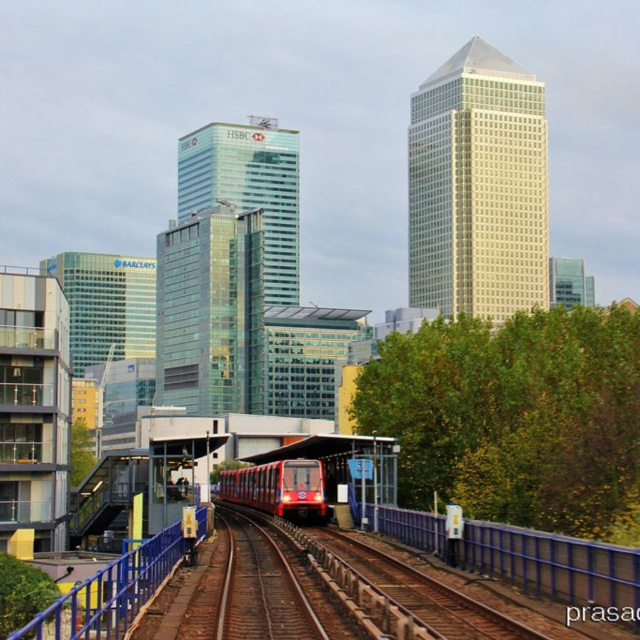
Question: Estimate the real-world distances between objects in this image. Which object is closer to the blue metallic rail at lower left?

Choices:
 (A) metallic red train at center
 (B) blue metallic rail at center

Answer: (B)

Question: Which object appears farthest from the camera in this image?

Choices:
 (A) blue metallic rail at center
 (B) blue metallic rail at lower left
 (C) metallic red train at center

Answer: (C)

Question: Can you confirm if blue metallic rail at lower left is smaller than metallic red train at center?

Choices:
 (A) no
 (B) yes

Answer: (B)

Question: Which point is farther to the camera?

Choices:
 (A) metallic red train at center
 (B) blue metallic rail at lower left
 (C) blue metallic rail at center

Answer: (A)

Question: Is blue metallic rail at lower left further to the viewer compared to metallic red train at center?

Choices:
 (A) no
 (B) yes

Answer: (A)

Question: Does blue metallic rail at center lie in front of blue metallic rail at lower left?

Choices:
 (A) no
 (B) yes

Answer: (A)